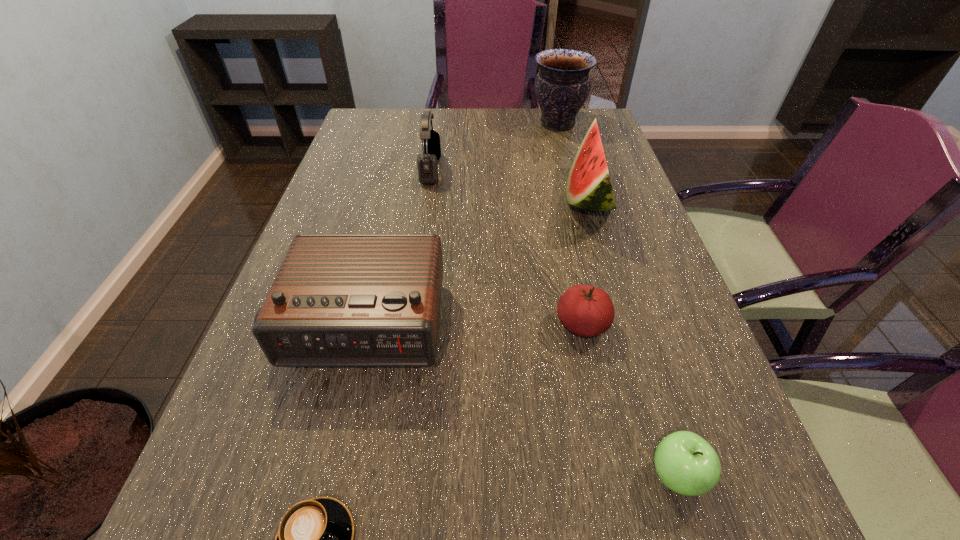
You are a GUI agent. You are given a task and a screenshot of the screen. Output one action in this format:
    pyautogui.click(x=<x>, y=<y>)
    Task: Click on the vacant area that lies between the apple and the tomato
    
    Given the screenshot: What is the action you would take?
    pyautogui.click(x=630, y=401)

This screenshot has height=540, width=960. In order to click on free spot between the farthest object and the watermelon in this screenshot , I will do `click(573, 161)`.

Find the location of a particular element. The width and height of the screenshot is (960, 540). unoccupied area between the tomato and the farthest object is located at coordinates (570, 225).

Where is `free spot between the headset and the tomato`? The image size is (960, 540). free spot between the headset and the tomato is located at coordinates coord(506,247).

Select which object is the fourth closest to the headset. Please provide its 2D coordinates. Your answer should be formatted as a tuple, i.e. [(x, y)], where the tuple contains the x and y coordinates of a point satisfying the conditions above.

[(586, 311)]

I want to click on the closest object relative to the shortest object, so click(339, 300).

The width and height of the screenshot is (960, 540). I want to click on vacant space that satisfies the following two spatial constraints: 1. on the outer rind of the watermelon; 2. on the right side of the apple, so click(671, 476).

This screenshot has height=540, width=960. I want to click on free space that satisfies the following two spatial constraints: 1. on the front panel of the tomato; 2. on the right side of the radio receiver, so click(363, 325).

This screenshot has height=540, width=960. What are the coordinates of `free point that satisfies the following two spatial constraints: 1. on the headband of the apple; 2. on the left side of the headset` in the screenshot? It's located at (386, 476).

Where is `free space that satisfies the following two spatial constraints: 1. on the headband of the headset; 2. on the back side of the tomato`? free space that satisfies the following two spatial constraints: 1. on the headband of the headset; 2. on the back side of the tomato is located at coordinates (408, 325).